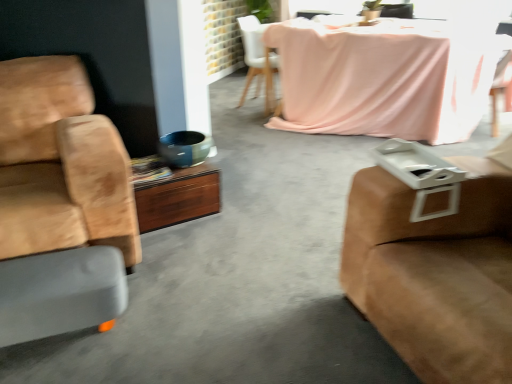
Question: Based on their positions, is wooden desk at center located to the left or right of suede brown studio couch at right?

Choices:
 (A) right
 (B) left

Answer: (B)

Question: From their relative heights in the image, would you say wooden desk at center is taller or shorter than suede brown studio couch at right?

Choices:
 (A) tall
 (B) short

Answer: (B)

Question: Estimate the real-world distances between objects in this image. Which object is farther from the matte green ceramic bowl at center?

Choices:
 (A) wooden chair at upper right, which ranks as the second chair in front-to-back order
 (B) pink fabric chair at upper center, which is the second chair in right-to-left order
 (C) wooden desk at center
 (D) gray rubber footrest at lower left
 (E) pink fabric-covered table at upper center

Answer: (A)

Question: Which is nearer to the suede brown studio couch at right?

Choices:
 (A) suede tan chair at left, the third chair when ordered from back to front
 (B) gray rubber footrest at lower left
 (C) pink fabric chair at upper center, the first chair when ordered from back to front
 (D) matte green ceramic bowl at center
 (E) wooden chair at upper right, which ranks as the second chair in front-to-back order

Answer: (B)